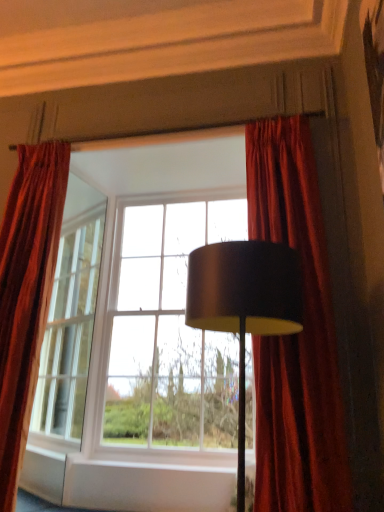
Question: Can you confirm if matte glass window at center is taller than velvet red curtain at left, placed as the first curtain when sorted from left to right?

Choices:
 (A) yes
 (B) no

Answer: (A)

Question: Considering the relative positions of matte glass window at center and velvet red curtain at left, which appears as the 2th curtain when viewed from the right, in the image provided, is matte glass window at center behind velvet red curtain at left, which appears as the 2th curtain when viewed from the right,?

Choices:
 (A) no
 (B) yes

Answer: (A)

Question: Is matte glass window at center turned away from velvet red curtain at left, placed as the first curtain when sorted from left to right?

Choices:
 (A) yes
 (B) no

Answer: (B)

Question: From the image's perspective, is matte glass window at center below velvet red curtain at left, placed as the first curtain when sorted from left to right?

Choices:
 (A) no
 (B) yes

Answer: (B)

Question: Can velvet red curtain at left, which appears as the 2th curtain when viewed from the right, be found inside matte glass window at center?

Choices:
 (A) yes
 (B) no

Answer: (B)

Question: From a real-world perspective, is velvet red curtain at right, placed as the second curtain when sorted from left to right, physically located above or below velvet red curtain at left, which appears as the 2th curtain when viewed from the right?

Choices:
 (A) below
 (B) above

Answer: (B)

Question: Is velvet red curtain at right, placed as the second curtain when sorted from left to right, taller or shorter than velvet red curtain at left, which appears as the 2th curtain when viewed from the right?

Choices:
 (A) short
 (B) tall

Answer: (A)

Question: Is velvet red curtain at right, arranged as the 1th curtain when viewed from the right, spatially inside velvet red curtain at left, which appears as the 2th curtain when viewed from the right, or outside of it?

Choices:
 (A) outside
 (B) inside

Answer: (A)

Question: Is velvet red curtain at right, arranged as the 1th curtain when viewed from the right, bigger or smaller than velvet red curtain at left, which appears as the 2th curtain when viewed from the right?

Choices:
 (A) small
 (B) big

Answer: (B)

Question: Do you think velvet red curtain at left, placed as the first curtain when sorted from left to right, is within velvet red curtain at right, arranged as the 1th curtain when viewed from the right, or outside of it?

Choices:
 (A) outside
 (B) inside

Answer: (A)

Question: In terms of height, does velvet red curtain at left, which appears as the 2th curtain when viewed from the right, look taller or shorter compared to velvet red curtain at right, placed as the second curtain when sorted from left to right?

Choices:
 (A) short
 (B) tall

Answer: (B)

Question: Is point (29, 331) closer or farther from the camera than point (327, 452)?

Choices:
 (A) farther
 (B) closer

Answer: (A)

Question: Is velvet red curtain at left, placed as the first curtain when sorted from left to right, bigger or smaller than velvet red curtain at right, placed as the second curtain when sorted from left to right?

Choices:
 (A) big
 (B) small

Answer: (B)

Question: From the image's perspective, is matte black lampshade at center located above or below velvet red curtain at right, arranged as the 1th curtain when viewed from the right?

Choices:
 (A) above
 (B) below

Answer: (B)

Question: Does point (243, 453) appear closer or farther from the camera than point (261, 135)?

Choices:
 (A) closer
 (B) farther

Answer: (A)